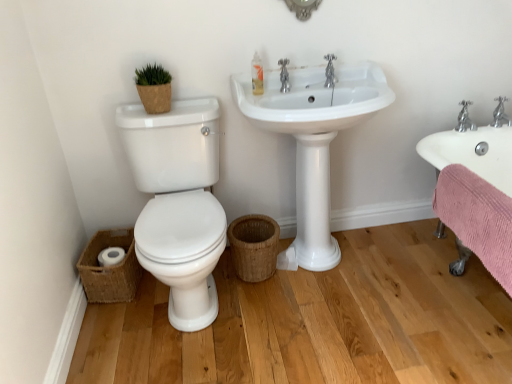
Where is `vacant point to the right of woven brown basket at lower left, arranged as the 1th basket when viewed from the left`? This screenshot has height=384, width=512. vacant point to the right of woven brown basket at lower left, arranged as the 1th basket when viewed from the left is located at coordinates (154, 295).